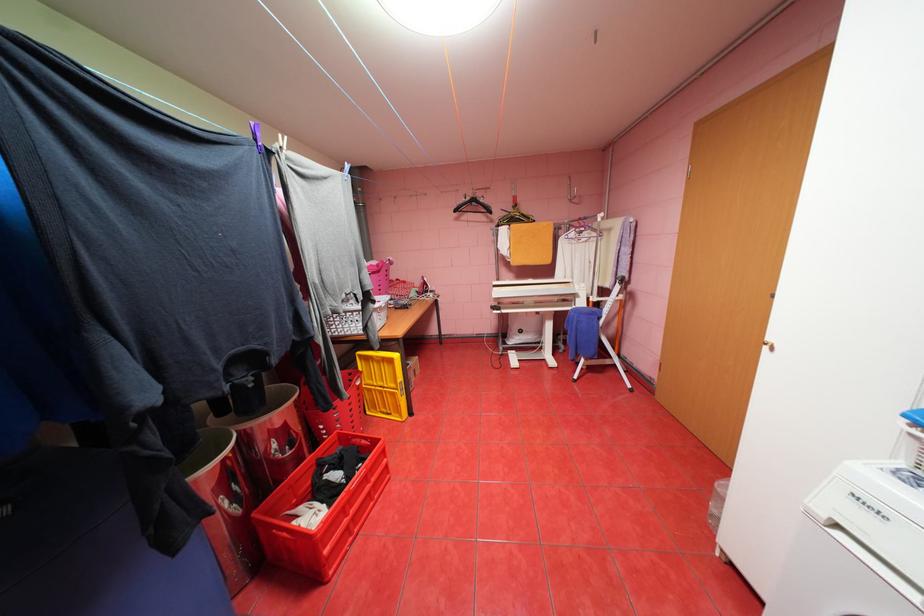
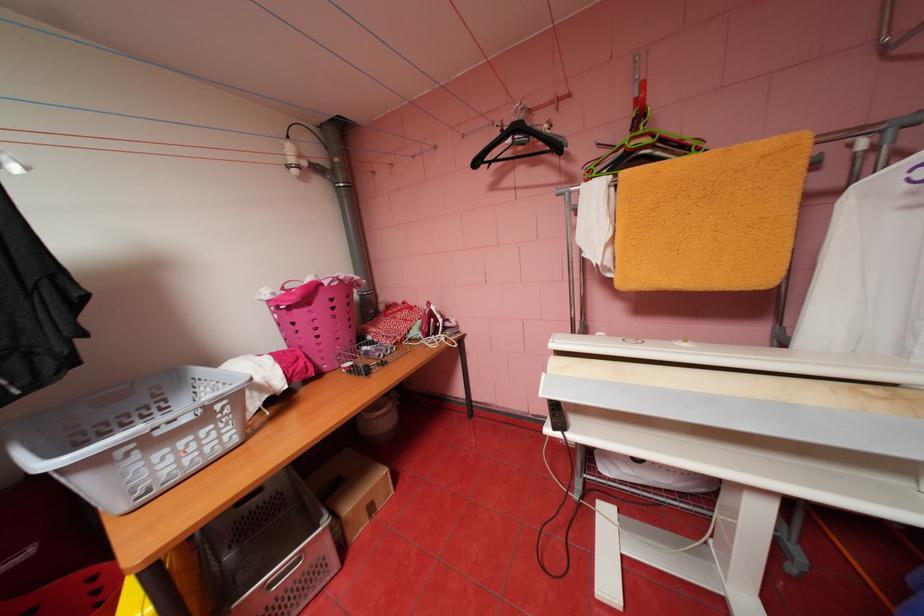
Question: The images are taken continuously from a first-person perspective. In which direction are you moving?

Choices:
 (A) Left
 (B) Right
 (C) Forward
 (D) Backward

Answer: (C)